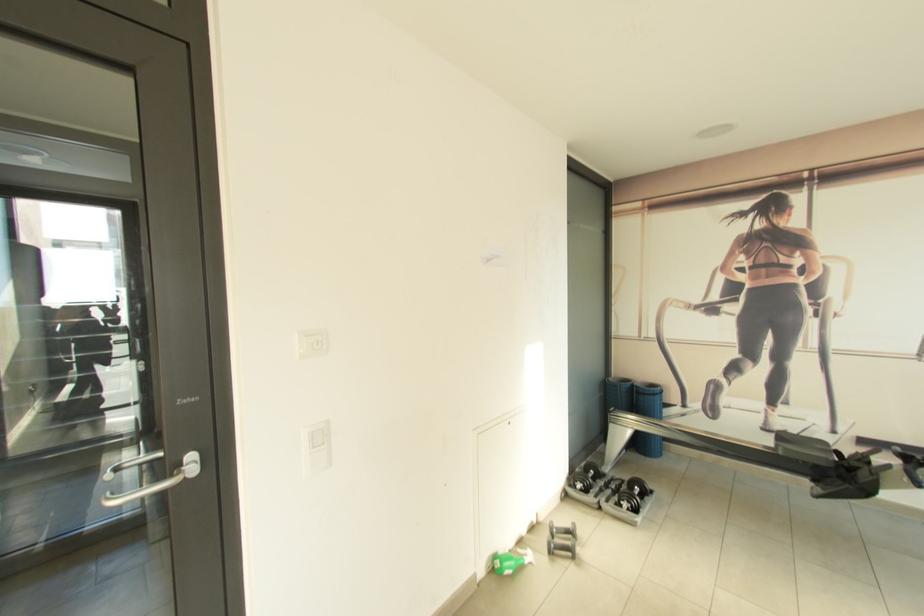
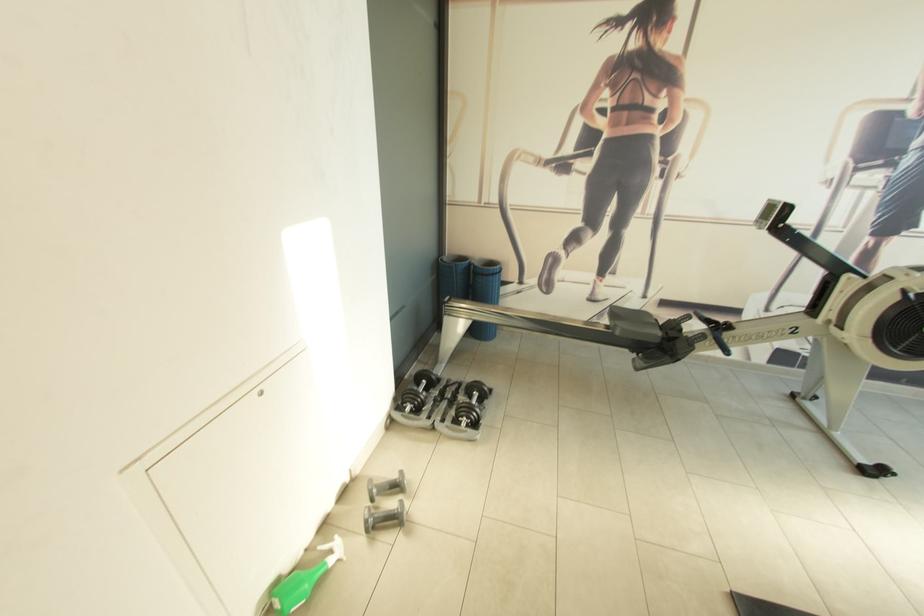
Where in the second image is the point corresponding to [532,556] from the first image?

(339, 551)